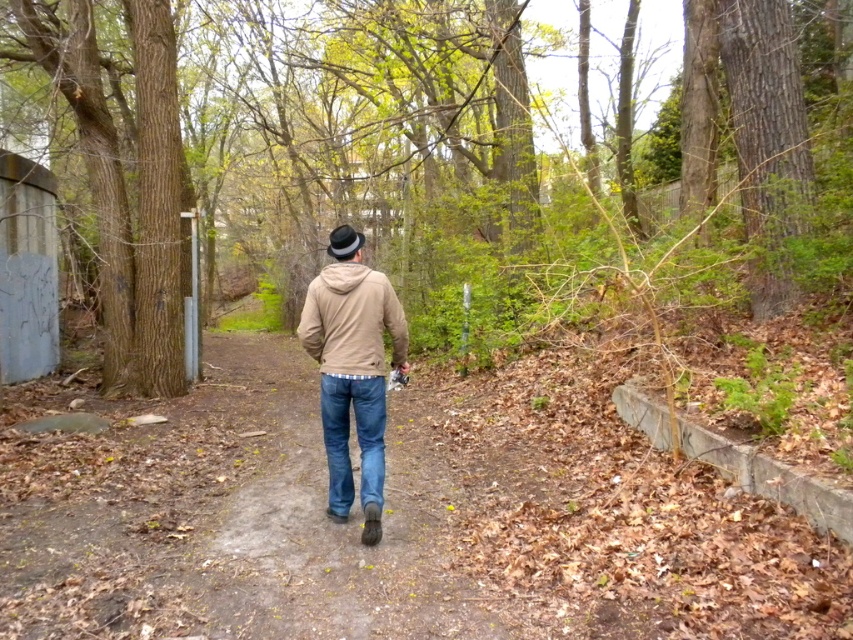
Question: Which object appears farthest from the camera in this image?

Choices:
 (A) matte beige jacket at center
 (B) matte brown jacket at center

Answer: (A)

Question: In this image, where is matte beige jacket at center located relative to denim jeans at center?

Choices:
 (A) left
 (B) right

Answer: (A)

Question: Where is matte brown jacket at center located in relation to matte beige jacket at center in the image?

Choices:
 (A) above
 (B) below

Answer: (B)

Question: Is matte beige jacket at center behind denim jeans at center?

Choices:
 (A) no
 (B) yes

Answer: (B)

Question: Considering the real-world distances, which object is closest to the matte brown jacket at center?

Choices:
 (A) denim jeans at center
 (B) matte beige jacket at center

Answer: (A)

Question: Among these objects, which one is nearest to the camera?

Choices:
 (A) matte beige jacket at center
 (B) matte brown jacket at center

Answer: (B)